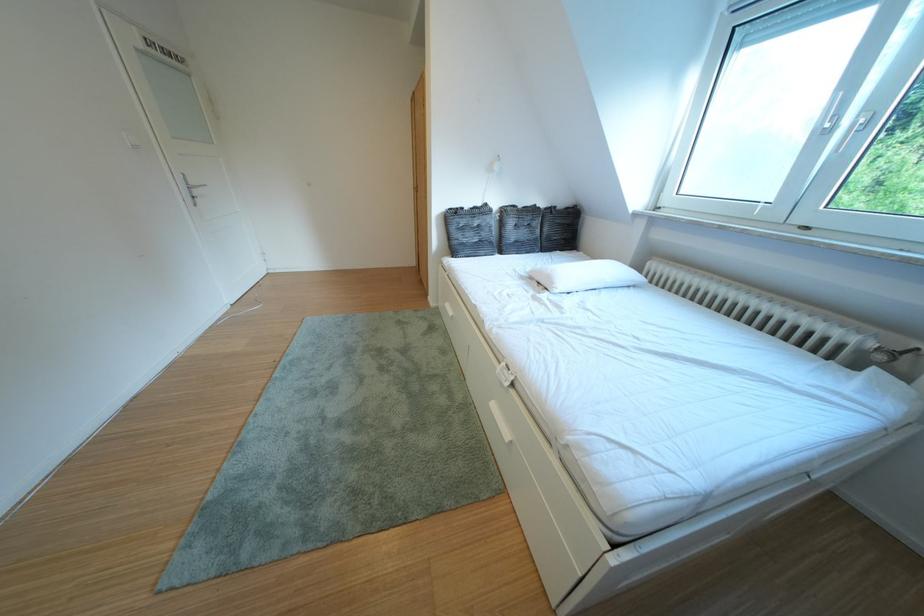
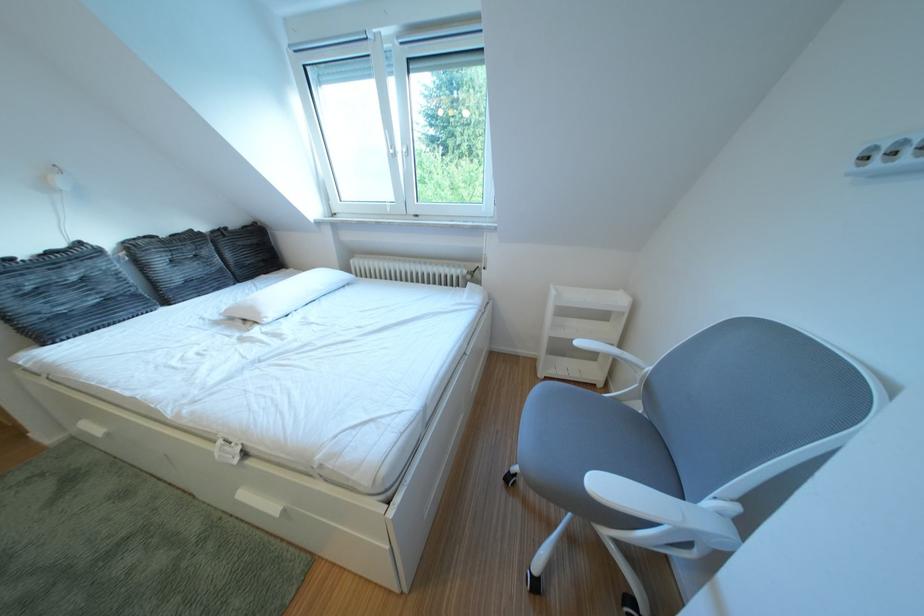
Where in the second image is the point corresponding to [868,344] from the first image?

(472, 277)